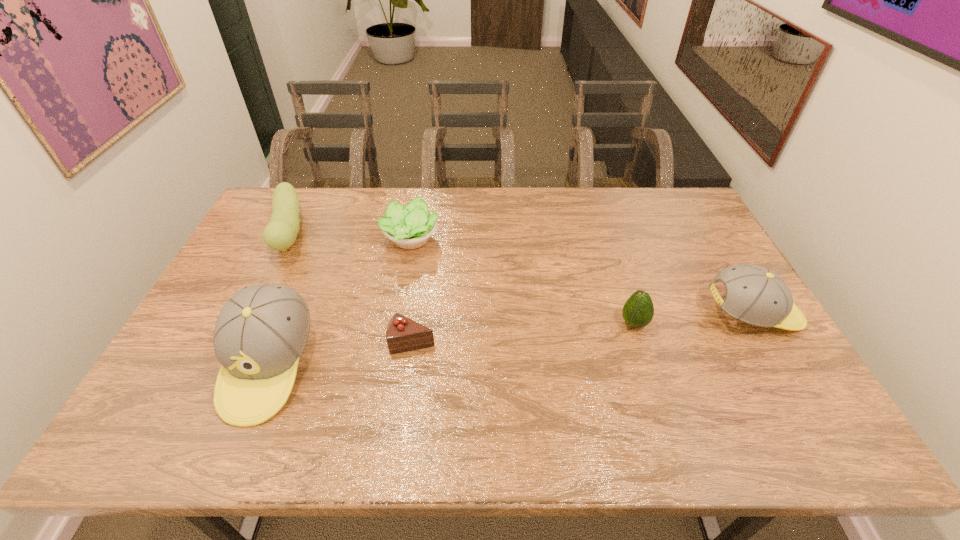
To achieve even spacing by inserting another baseball_cap among them, please point to a vacant spot for this new baseball_cap. Please provide its 2D coordinates. Your answer should be formatted as a tuple, i.e. [(x, y)], where the tuple contains the x and y coordinates of a point satisfying the conditions above.

[(523, 339)]